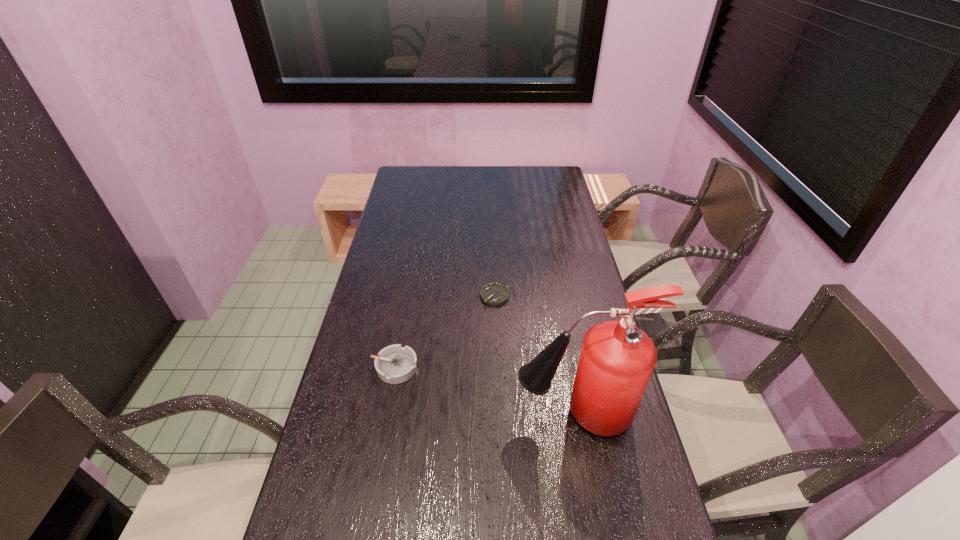
You are a GUI agent. You are given a task and a screenshot of the screen. Output one action in this format:
    pyautogui.click(x=<x>, y=<y>)
    Task: Click on the nearest object
    The image size is (960, 540).
    Given the screenshot: What is the action you would take?
    pyautogui.click(x=617, y=358)

Identify the location of the tallest object. The width and height of the screenshot is (960, 540). (617, 358).

Locate an element on the screen. This screenshot has width=960, height=540. the left ashtray is located at coordinates (395, 364).

The image size is (960, 540). I want to click on the leftmost object, so coord(395,364).

I want to click on the farther ashtray, so pyautogui.click(x=494, y=293).

Identify the location of the shorter ashtray. (494, 293).

This screenshot has height=540, width=960. In order to click on free space located 0.400m with the nozzle aimed from the nearest object in this screenshot , I will do `click(359, 414)`.

Where is `vacant region located 0.210m with the nozzle aimed from the nearest object`? vacant region located 0.210m with the nozzle aimed from the nearest object is located at coordinates (433, 414).

Identify the location of vacant area situated with the nozzle aimed from the nearest object. (418, 414).

Find the location of a particular element. vacant space located 0.060m on the left of the leftmost object is located at coordinates (x=350, y=367).